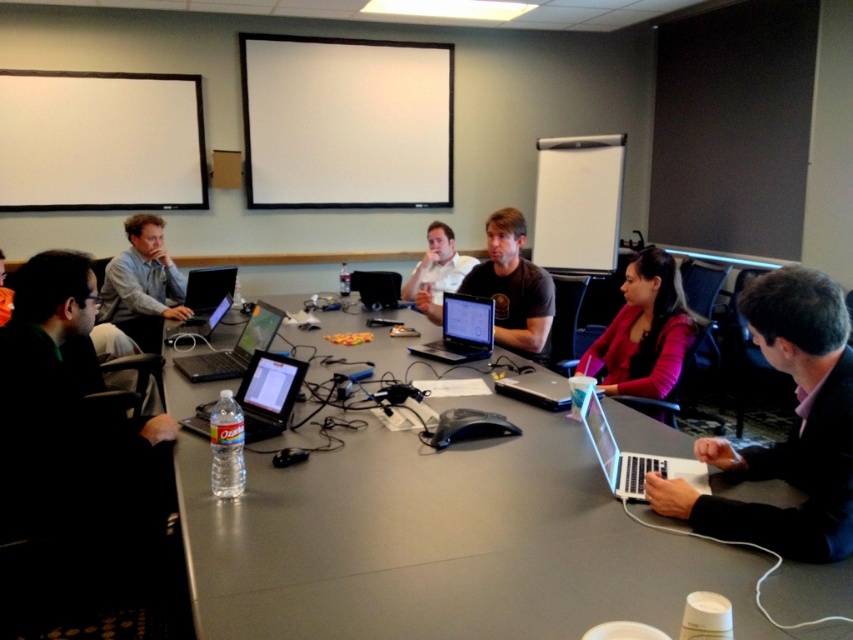
Question: Is pink matte jacket at center thinner than silver metallic laptop at left?

Choices:
 (A) no
 (B) yes

Answer: (A)

Question: Which object is the closest to the silver metallic laptop at center?

Choices:
 (A) silver metallic laptop at lower right
 (B) black glossy laptop at lower right
 (C) satin black laptop at center

Answer: (C)

Question: Does pink matte jacket at center have a greater width compared to silver metallic laptop at lower right?

Choices:
 (A) yes
 (B) no

Answer: (A)

Question: Among these points, which one is farthest from the camera?

Choices:
 (A) (527, 291)
 (B) (376, 272)

Answer: (B)

Question: Is black glossy laptop at lower right smaller than silver metallic laptop at lower right?

Choices:
 (A) no
 (B) yes

Answer: (A)

Question: Among these objects, which one is nearest to the camera?

Choices:
 (A) silver metallic laptop at center
 (B) silver metallic laptop at left
 (C) silver metallic laptop at lower right
 (D) brown casual shirt at center

Answer: (C)